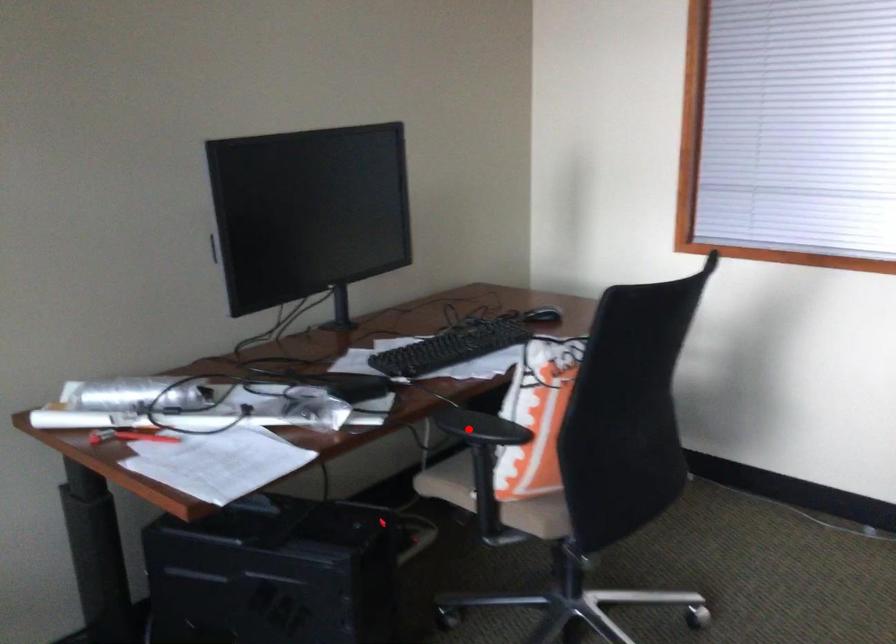
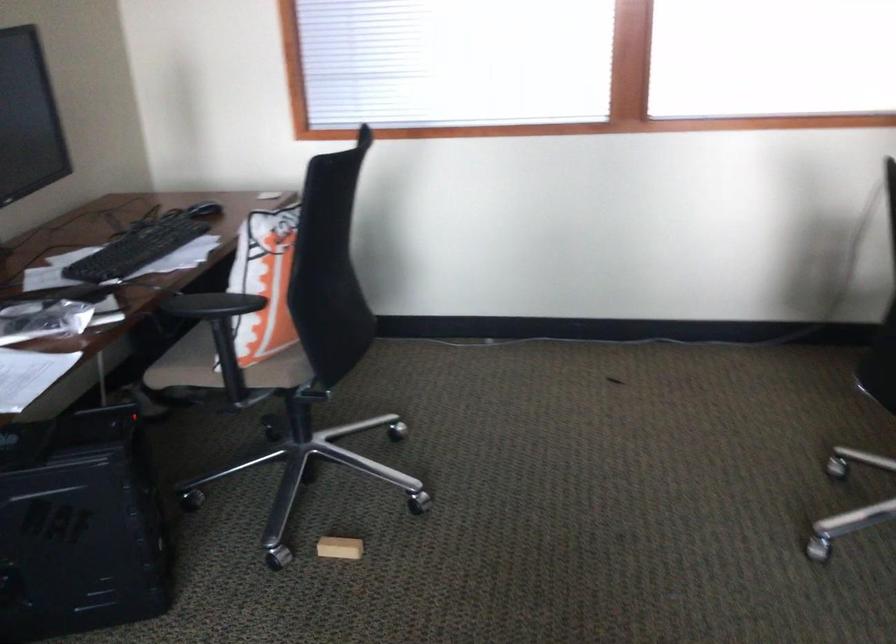
Locate, in the second image, the point that corresponds to the highlighted location in the first image.

(211, 305)